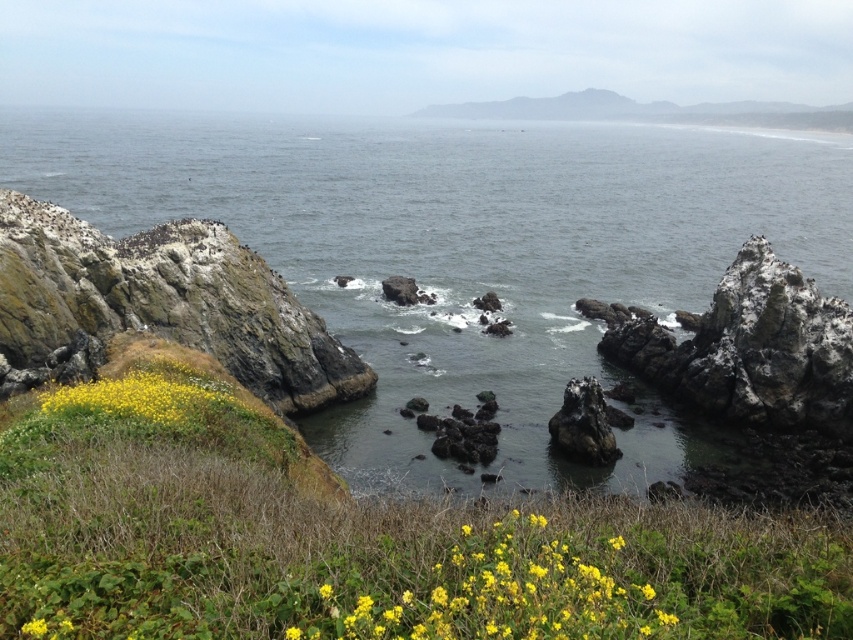
From the picture: Is yellow matte flowers at lower center thinner than yellow matte flower at lower center?

Incorrect, yellow matte flowers at lower center's width is not less than yellow matte flower at lower center's.

Locate an element on the screen. yellow matte flowers at lower center is located at coordinates (497, 593).

Measure the distance between rough textured rock at center and camera.

rough textured rock at center and camera are 31.80 meters apart from each other.

Looking at this image, does rough textured rock at center have a greater width compared to yellow matte flower at lower left?

Indeed, rough textured rock at center has a greater width compared to yellow matte flower at lower left.

Who is more forward, [550,429] or [41,636]?

Point [41,636] is more forward.

This screenshot has width=853, height=640. Identify the location of rough textured rock at center. (583, 426).

Does rusty stone cliff at left appear over yellow matte flowers at lower left?

Correct, rusty stone cliff at left is located above yellow matte flowers at lower left.

Is point (196, 344) less distant than point (83, 412)?

No.

What do you see at coordinates (165, 301) in the screenshot? The width and height of the screenshot is (853, 640). I see `rusty stone cliff at left` at bounding box center [165, 301].

Locate an element on the screen. The height and width of the screenshot is (640, 853). rusty stone cliff at left is located at coordinates (165, 301).